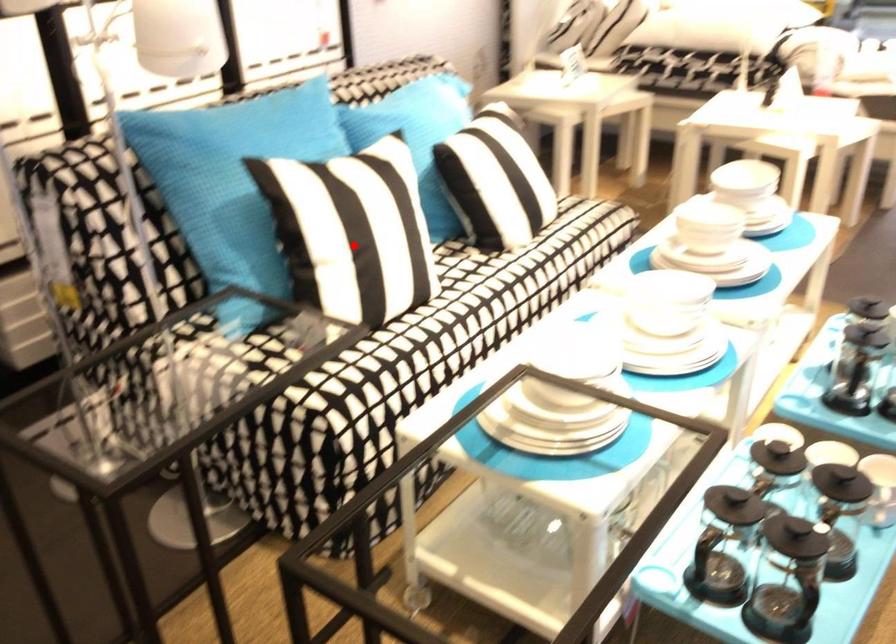
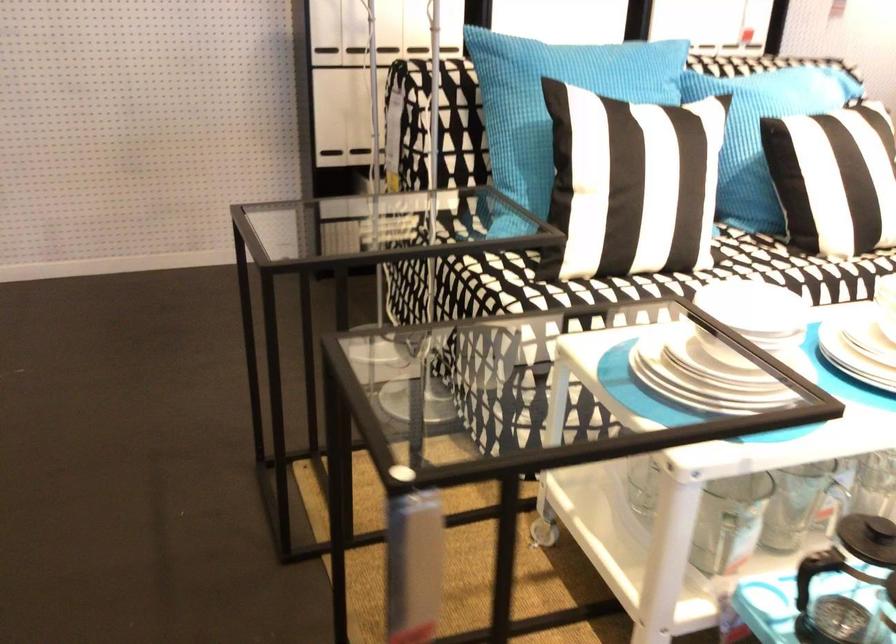
Where in the second image is the point corresponding to the highlighted location from the first image?

(617, 180)